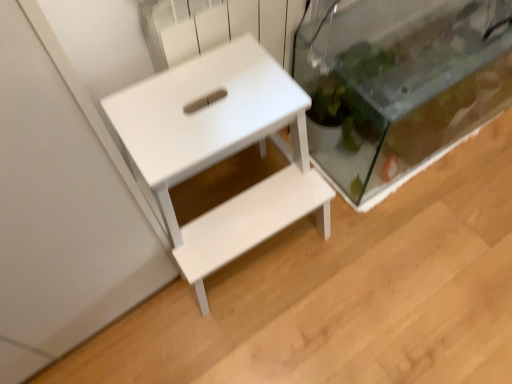
Where is `spots to the right of white matte table at center`? This screenshot has height=384, width=512. spots to the right of white matte table at center is located at coordinates [371, 265].